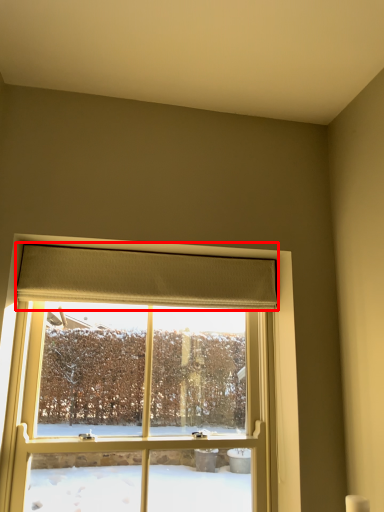
Question: From the image's perspective, where is curtain (annotated by the red box) located relative to window?

Choices:
 (A) below
 (B) above

Answer: (B)